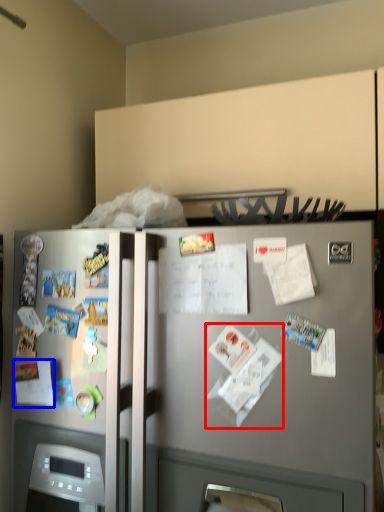
Question: Which of the following is the closest to the observer, paper (highlighted by a red box) or paper (highlighted by a blue box)?

Choices:
 (A) paper
 (B) paper

Answer: (A)